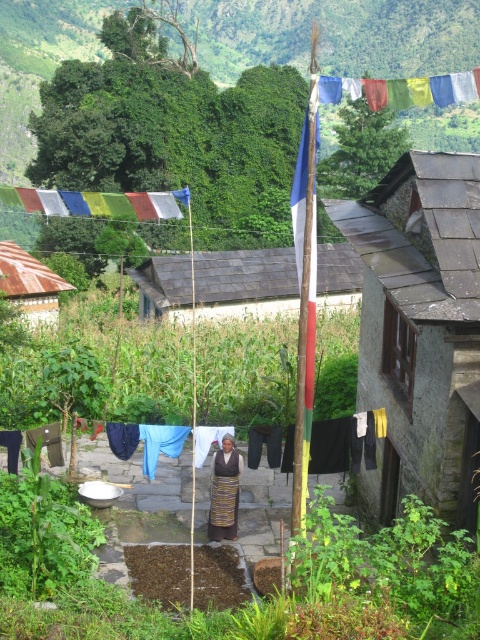
Question: Considering the relative positions of white painted wood hut at center and blue fabric at center in the image provided, where is white painted wood hut at center located with respect to blue fabric at center?

Choices:
 (A) above
 (B) below

Answer: (A)

Question: Which of the following is the closest to the observer?

Choices:
 (A) (415, 100)
 (B) (282, 461)

Answer: (A)

Question: Which point appears farthest from the camera in this image?

Choices:
 (A) (384, 422)
 (B) (342, 275)
 (C) (382, 288)

Answer: (B)

Question: Which point is farther to the camera?

Choices:
 (A) (220, 483)
 (B) (39, 314)
 (C) (183, 301)
 (D) (443, 477)

Answer: (B)

Question: Can you confirm if white painted wood hut at center is positioned above multicolored fabric at upper center?

Choices:
 (A) yes
 (B) no

Answer: (B)

Question: Can you confirm if multicolored fabric at upper center is smaller than striped fabric person at center?

Choices:
 (A) no
 (B) yes

Answer: (A)